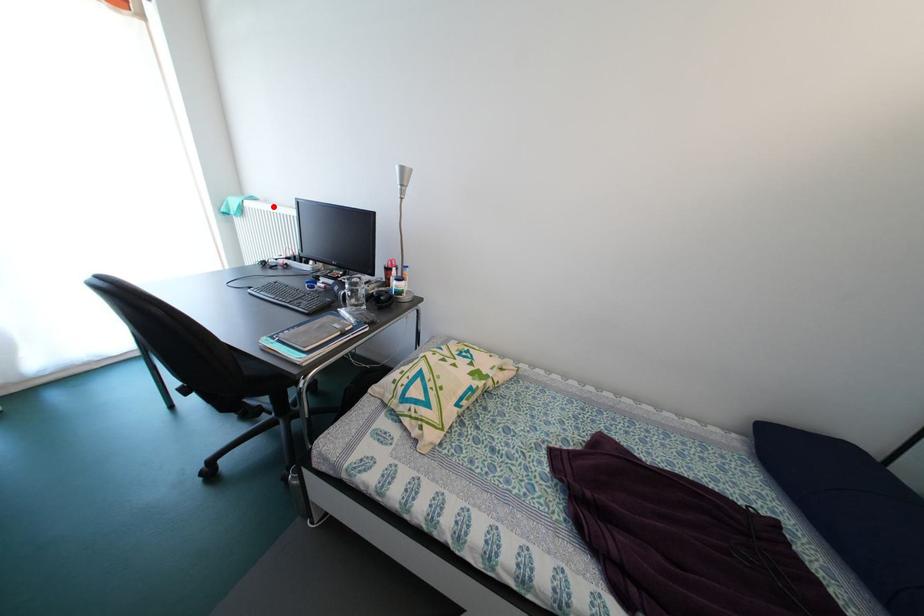
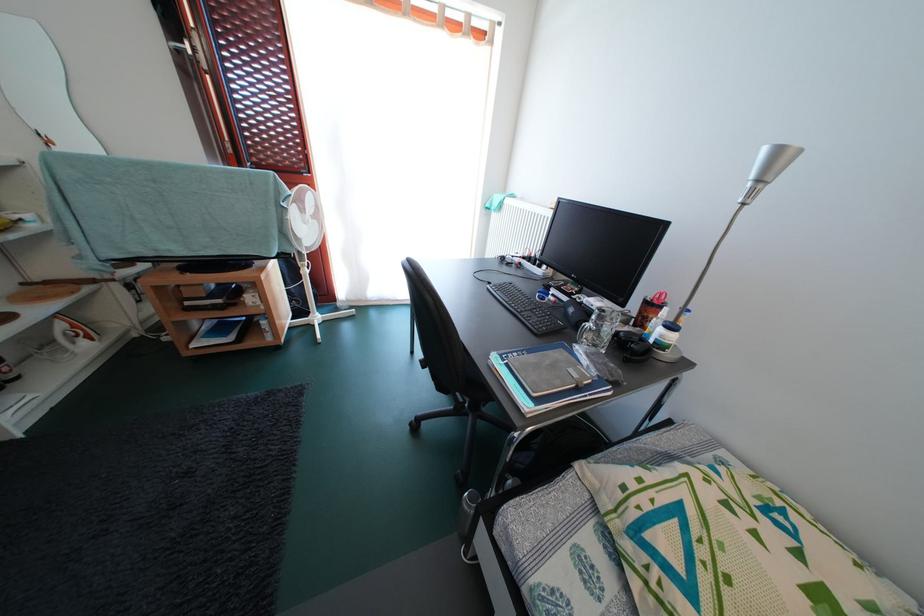
Question: I am providing you with two images of the same scene from different viewpoints. In image1, a red point is highlighted. Considering the same 3D point in image2, which of the following is correct?

Choices:
 (A) It is closer
 (B) It is farther

Answer: (A)